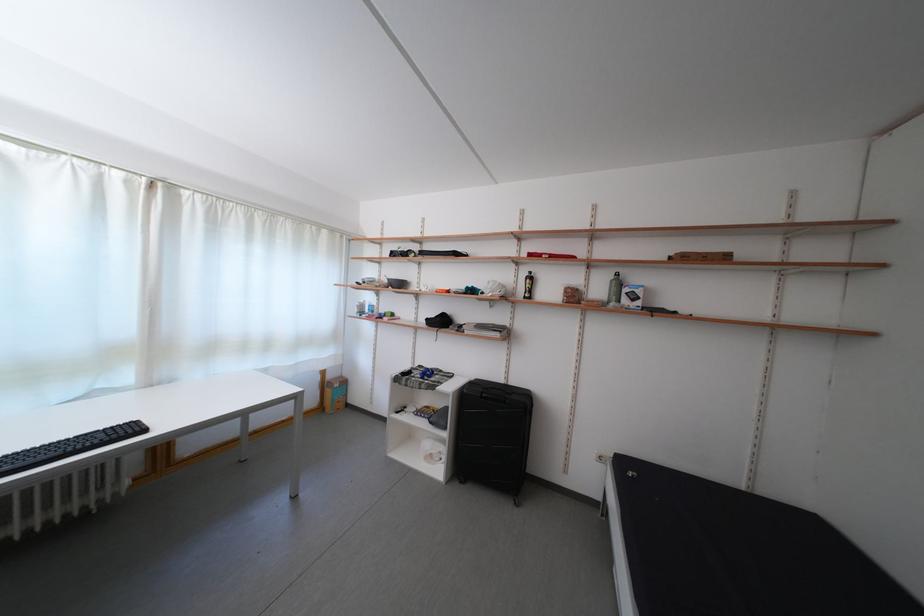
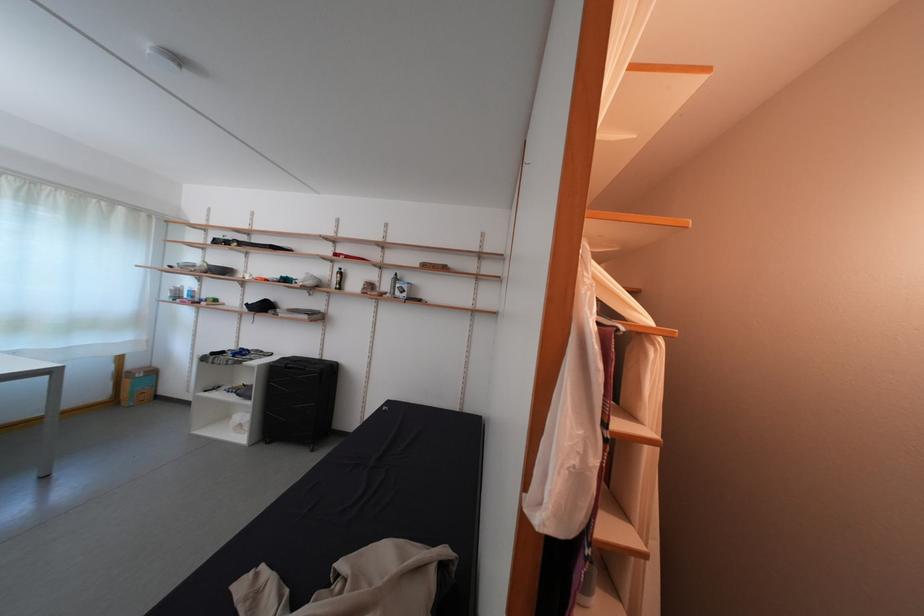
The point at (525, 294) is marked in the first image. Where is the corresponding point in the second image?

(339, 286)